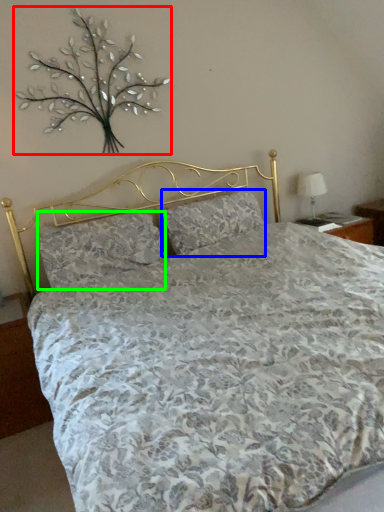
Question: Which object is the closest to the floral arrangement (highlighted by a red box)? Choose among these: pillow (highlighted by a blue box) or pillow (highlighted by a green box).

Choices:
 (A) pillow
 (B) pillow

Answer: (B)